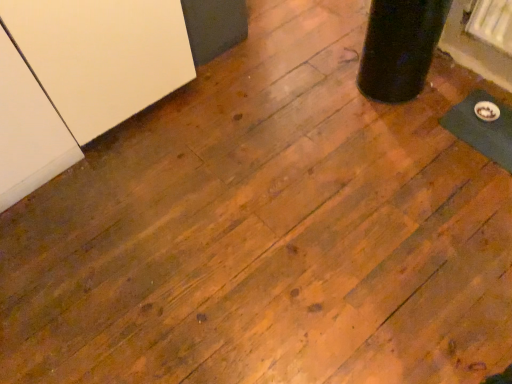
What do you see at coordinates (102, 56) in the screenshot?
I see `white matte door at lower left` at bounding box center [102, 56].

Identify the location of white matte door at lower left. Image resolution: width=512 pixels, height=384 pixels. pyautogui.click(x=102, y=56).

This screenshot has width=512, height=384. Find the location of `white matte door at lower left`. white matte door at lower left is located at coordinates (102, 56).